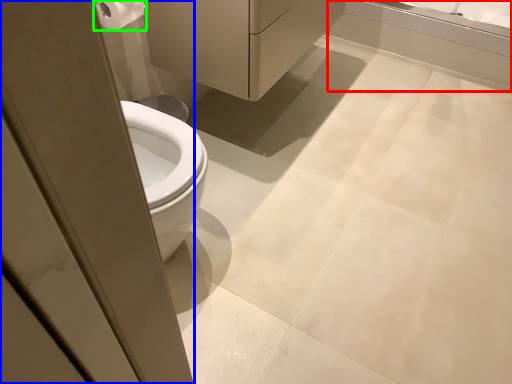
Question: Which object is the closest to the bath (highlighted by a red box)? Choose among these: screen door (highlighted by a blue box) or toilet paper (highlighted by a green box).

Choices:
 (A) screen door
 (B) toilet paper

Answer: (B)